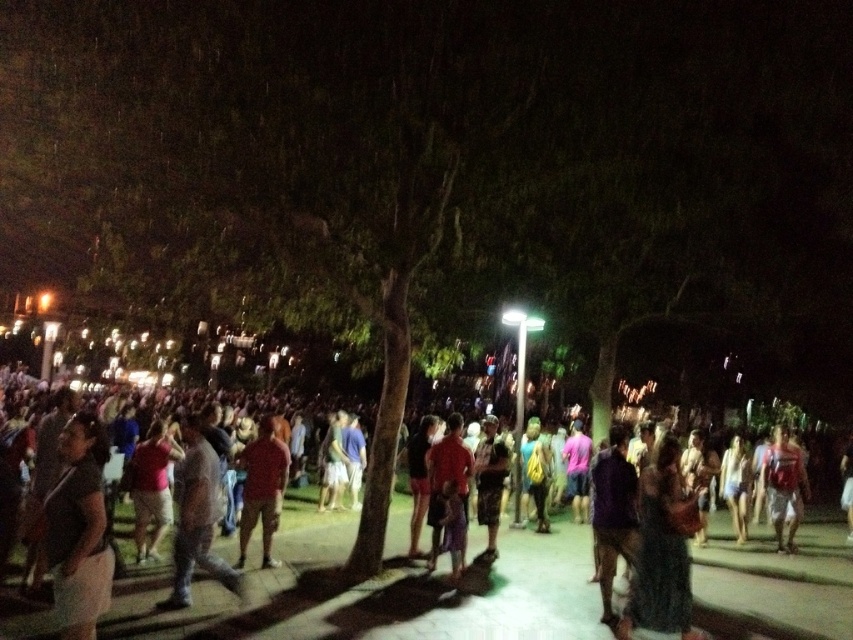
You are standing at point (259, 486) in the image. The nearest exit is 7.29 meters away. If you can walk at 1.5 meters per second, how many seconds will it take you to reach the nearest exit?

The nearest exit is 7.29 meters away, and you walk at 1.5 meters per second. To calculate the time, divide the distance by speed. 7.29 divided by 1.5 equals approximately 4.86 seconds. So it will take about 4.86 seconds to reach the nearest exit.

You are organizing a photo shoot and need to arrange the dark gray fabric shirt at lower left and the matte red shirt at center based on their sizes. Which shirt should be placed first if you want the smaller one in front?

Answer: The dark gray fabric shirt at lower left should be placed first since it is smaller than the matte red shirt at center, allowing it to be positioned in front without being obscured.

You are at a nighttime event and see a person wearing dark gray shirt at center and dark gray casual pants at center. Which part of their outfit has a larger width?

The dark gray shirt at center has a larger width than the dark gray casual pants at center.